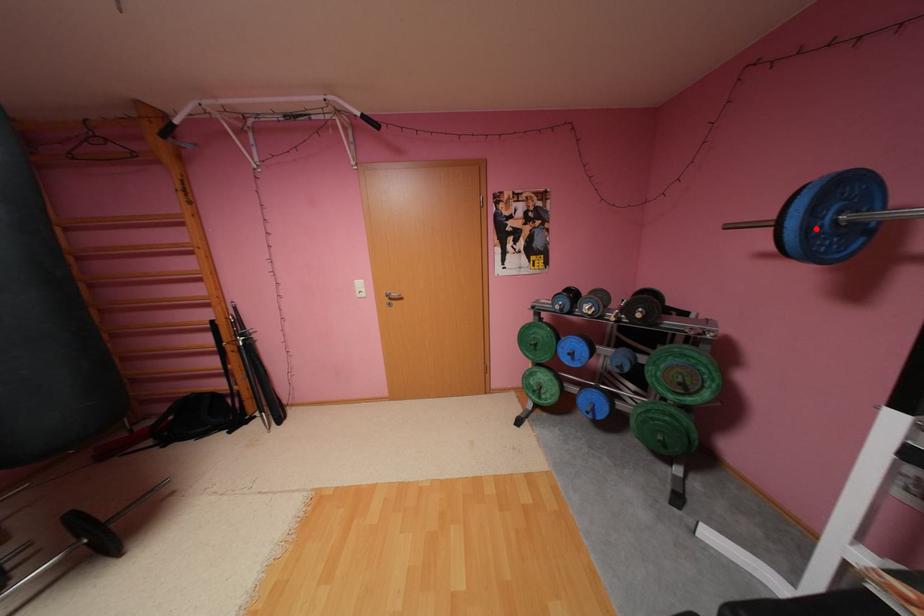
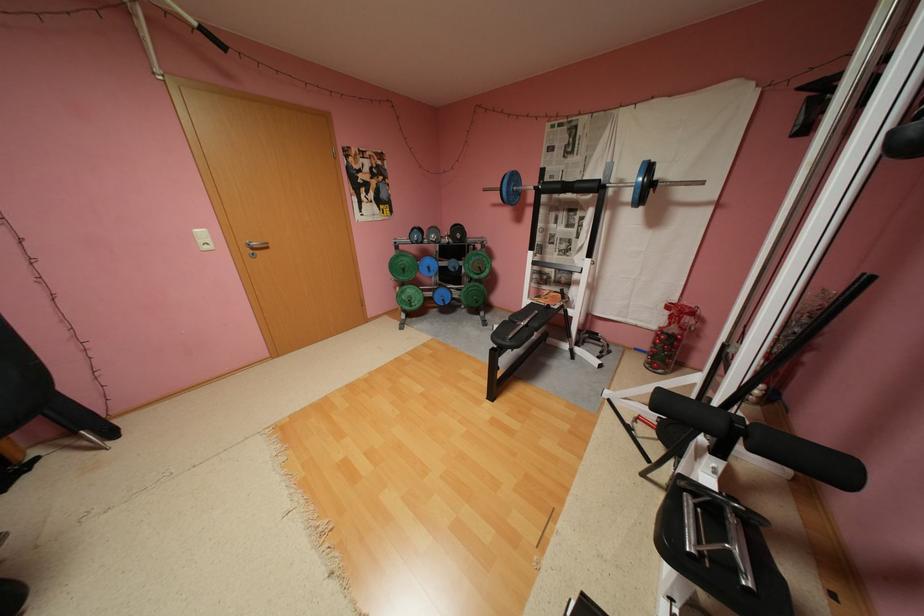
Question: I am providing you with two images of the same scene from different viewpoints. In image1, a red point is highlighted. Considering the same 3D point in image2, which of the following is correct?

Choices:
 (A) It is closer
 (B) It is farther

Answer: (A)